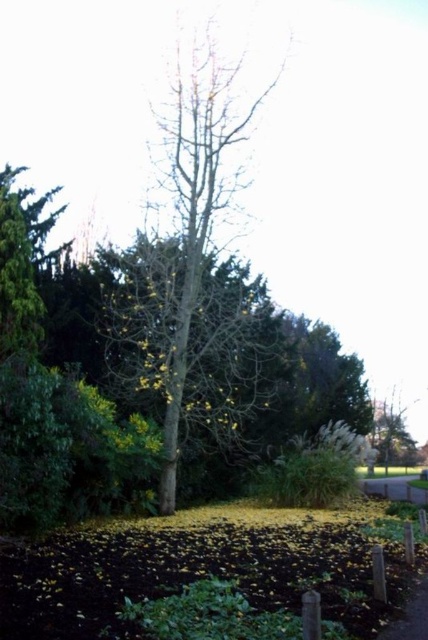
Question: Which object is closer to the camera taking this photo?

Choices:
 (A) yellow-green leafy tree at center
 (B) concrete pavement at lower right

Answer: (A)

Question: Is yellow-green leafy tree at center wider than concrete pavement at lower right?

Choices:
 (A) no
 (B) yes

Answer: (A)

Question: Which object appears closest to the camera in this image?

Choices:
 (A) concrete pavement at lower right
 (B) yellow-green leafy tree at center

Answer: (B)

Question: Does yellow-green leafy tree at center appear over concrete pavement at lower right?

Choices:
 (A) yes
 (B) no

Answer: (A)

Question: Which object appears closest to the camera in this image?

Choices:
 (A) yellow-green leafy tree at center
 (B) concrete pavement at lower right

Answer: (A)

Question: Where is yellow-green leafy tree at center located in relation to concrete pavement at lower right in the image?

Choices:
 (A) below
 (B) above

Answer: (B)